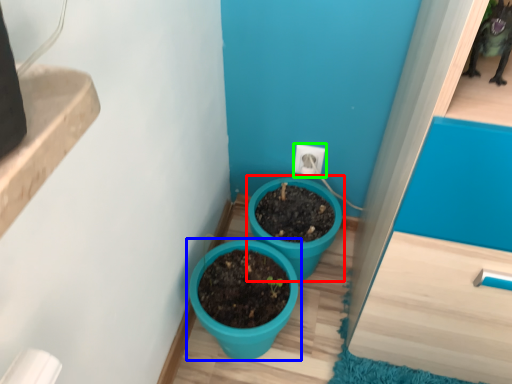
Question: Which is farther away from flowerpot (highlighted by a red box)? flowerpot (highlighted by a blue box) or electric outlet (highlighted by a green box)?

Choices:
 (A) flowerpot
 (B) electric outlet

Answer: (B)